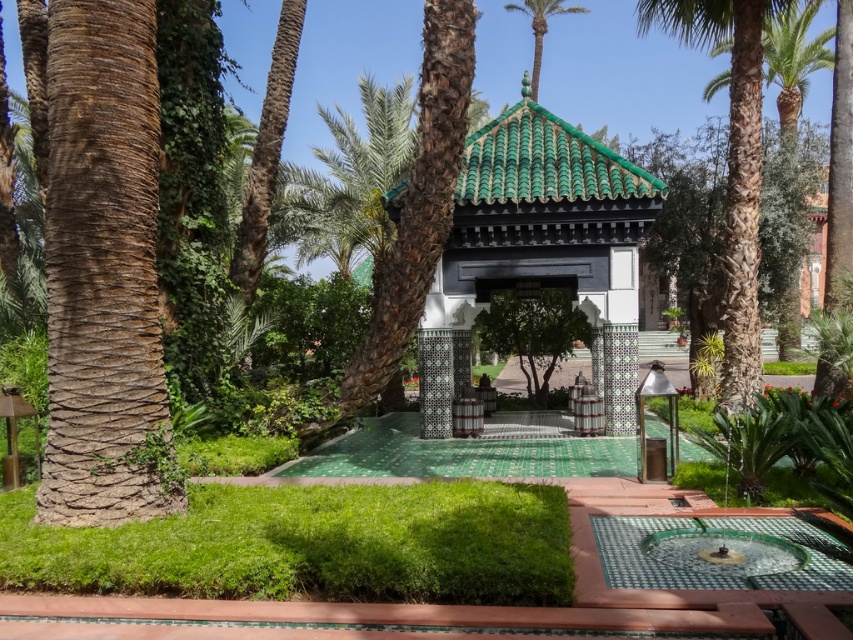
Can you confirm if green glazed tile gazebo at center is bigger than green leafy palm tree at upper center?

Actually, green glazed tile gazebo at center might be smaller than green leafy palm tree at upper center.

Is point (572, 243) in front of point (544, 1)?

Yes, it is in front of point (544, 1).

In order to click on green glazed tile gazebo at center in this screenshot , I will do [537, 248].

Can you confirm if green glazed tile gazebo at center is shorter than green leafy palm tree at right?

Correct, green glazed tile gazebo at center is not as tall as green leafy palm tree at right.

Between point (540, 180) and point (740, 396), which one is positioned in front?

Positioned in front is point (740, 396).

Between point (602, 161) and point (740, 52), which one is positioned in front?

Point (740, 52)

Where is `green glazed tile gazebo at center`? green glazed tile gazebo at center is located at coordinates (537, 248).

Which is in front, point (392, 541) or point (730, 365)?

Point (392, 541) is in front.

Is green lush grass at lower left positioned at the back of green leafy palm tree at right?

No.

In the scene shown: Who is more forward, [424,573] or [737,394]?

Point [424,573]

You are a GUI agent. You are given a task and a screenshot of the screen. Output one action in this format:
    pyautogui.click(x=<x>, y=<y>)
    Task: Click on the green lush grass at lower left
    This screenshot has height=640, width=853.
    Given the screenshot: What is the action you would take?
    pyautogui.click(x=311, y=545)